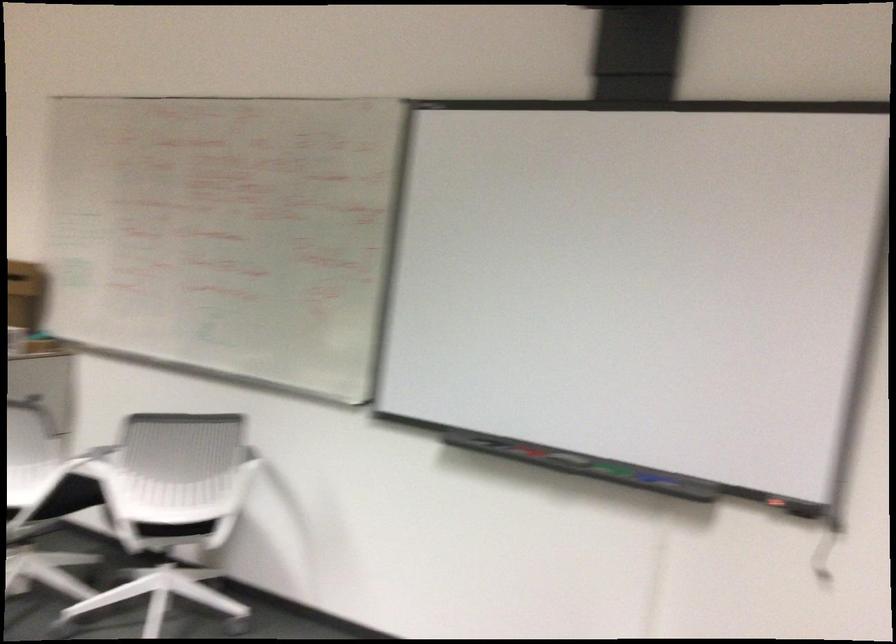
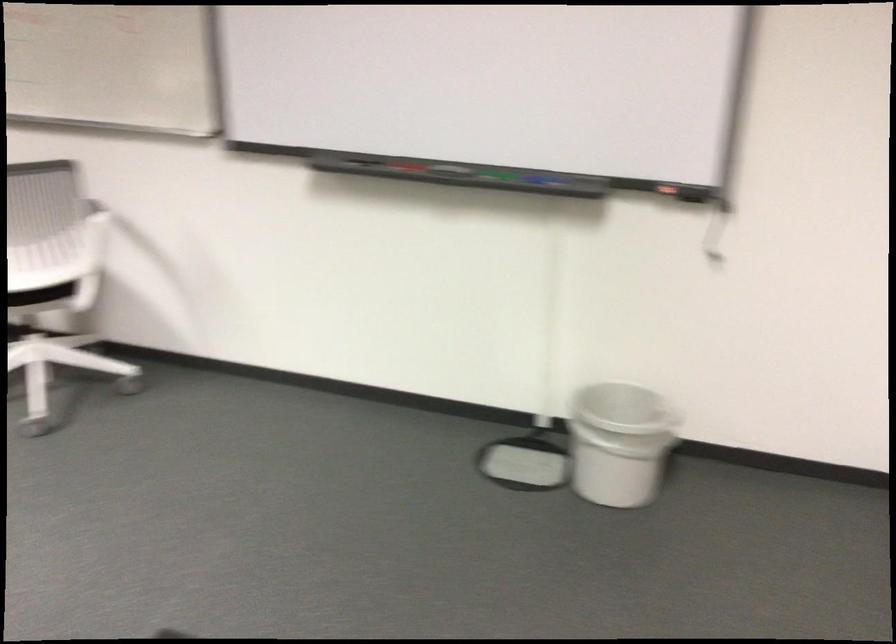
Locate, in the second image, the point that corresponds to the point at 530,451 in the first image.

(407, 167)